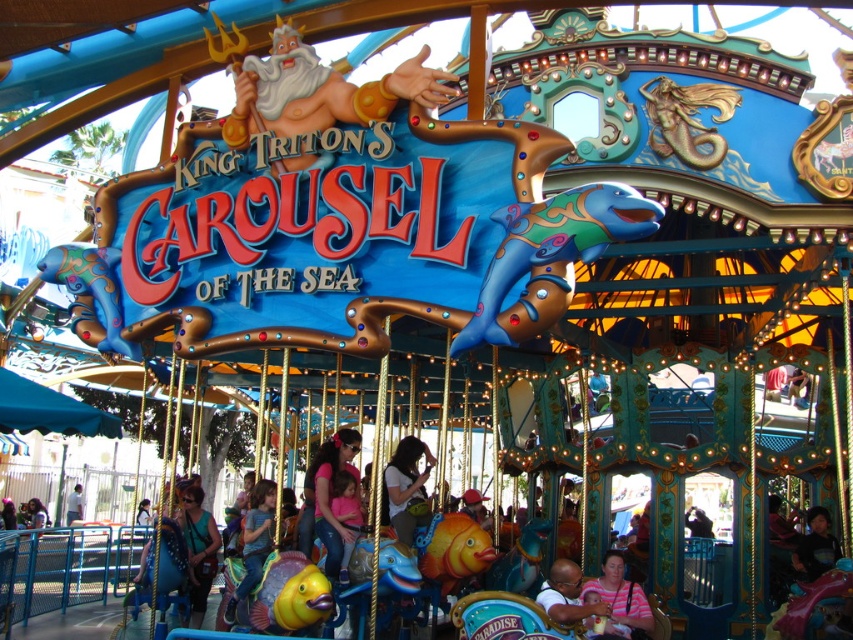
Is point (432, 464) closer to camera compared to point (602, 556)?

No.

Between point (415, 496) and point (606, 572), which one is positioned behind?

The point (415, 496) is more distant.

Locate an element on the screen. This screenshot has width=853, height=640. matte pink shirt at center is located at coordinates (407, 486).

Can you confirm if matte yellow fish at center is positioned to the right of matte pink dress at center?

No, matte yellow fish at center is not to the right of matte pink dress at center.

Image resolution: width=853 pixels, height=640 pixels. Describe the element at coordinates (254, 541) in the screenshot. I see `matte yellow fish at center` at that location.

This screenshot has width=853, height=640. I want to click on matte yellow fish at center, so click(254, 541).

Can you confirm if matte pink shirt at center is bigger than smooth skin baby at center?

Indeed, matte pink shirt at center has a larger size compared to smooth skin baby at center.

Between matte pink shirt at center and smooth skin baby at center, which one appears on the left side from the viewer's perspective?

matte pink shirt at center

What do you see at coordinates (407, 486) in the screenshot? I see `matte pink shirt at center` at bounding box center [407, 486].

Where is `matte pink shirt at center`? matte pink shirt at center is located at coordinates (407, 486).